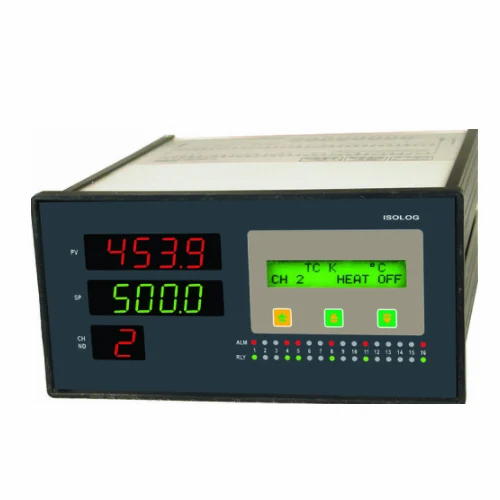
In order to click on electronics in this screenshot , I will do `click(236, 238)`.